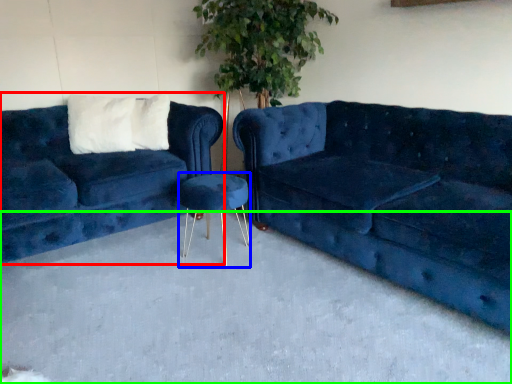
Question: Estimate the real-world distances between objects in this image. Which object is farther from studio couch (highlighted by a red box), bar stool (highlighted by a blue box) or concrete (highlighted by a green box)?

Choices:
 (A) bar stool
 (B) concrete

Answer: (B)